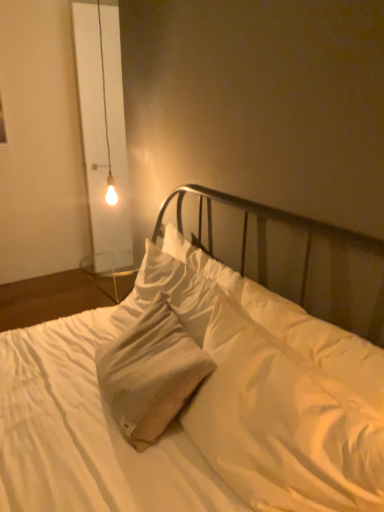
Question: Is white cotton pillow at center situated inside matte glass bulb at upper left or outside?

Choices:
 (A) inside
 (B) outside

Answer: (B)

Question: In the image, is white cotton pillow at center positioned in front of or behind matte glass bulb at upper left?

Choices:
 (A) front
 (B) behind

Answer: (A)

Question: Estimate the real-world distances between objects in this image. Which object is closer to the matte glass bulb at upper left?

Choices:
 (A) white cotton pillow at center
 (B) white cotton bed at center

Answer: (A)

Question: Which of these objects is positioned farthest from the matte glass bulb at upper left?

Choices:
 (A) white cotton pillow at center
 (B) white cotton bed at center

Answer: (B)